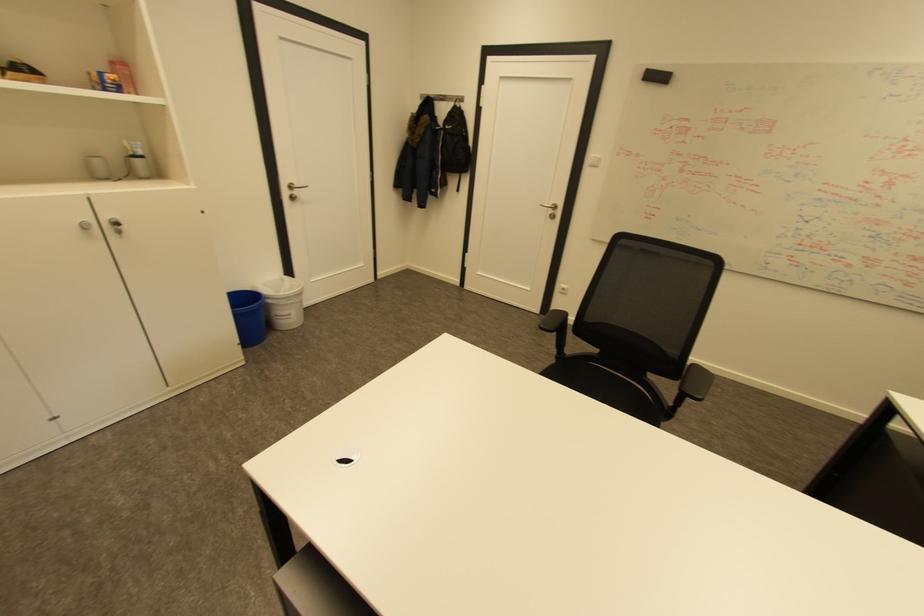
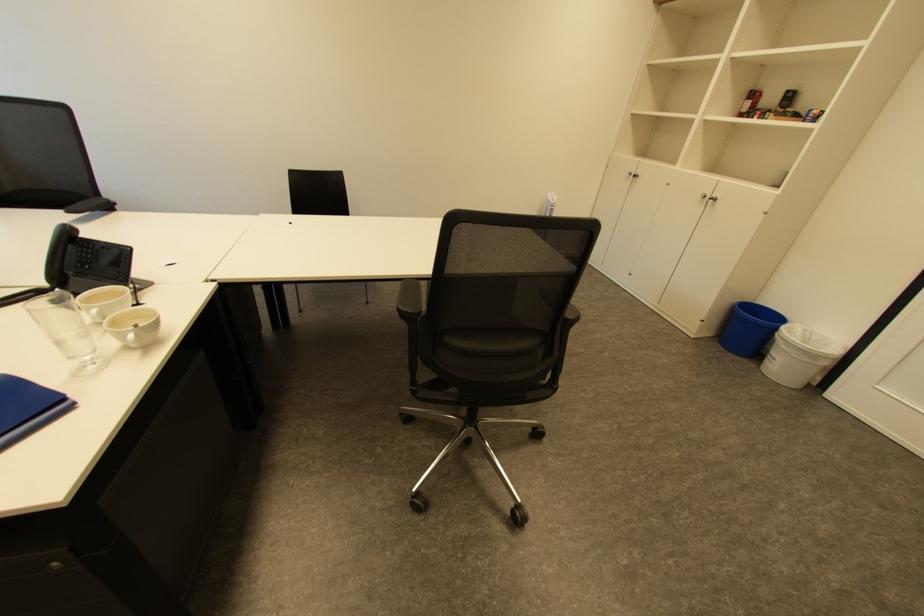
The point at (285, 333) is marked in the first image. Where is the corresponding point in the second image?

(760, 365)